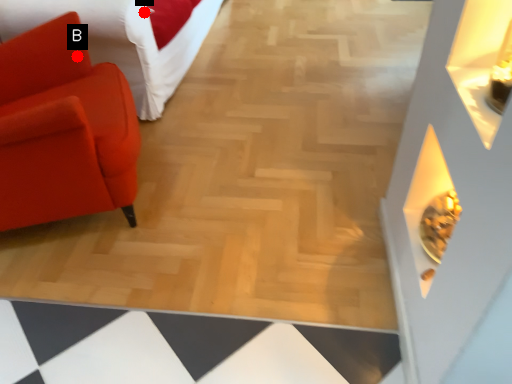
Question: Two points are circled on the image, labeled by A and B beside each circle. Which point is closer to the camera?

Choices:
 (A) A is closer
 (B) B is closer

Answer: (B)